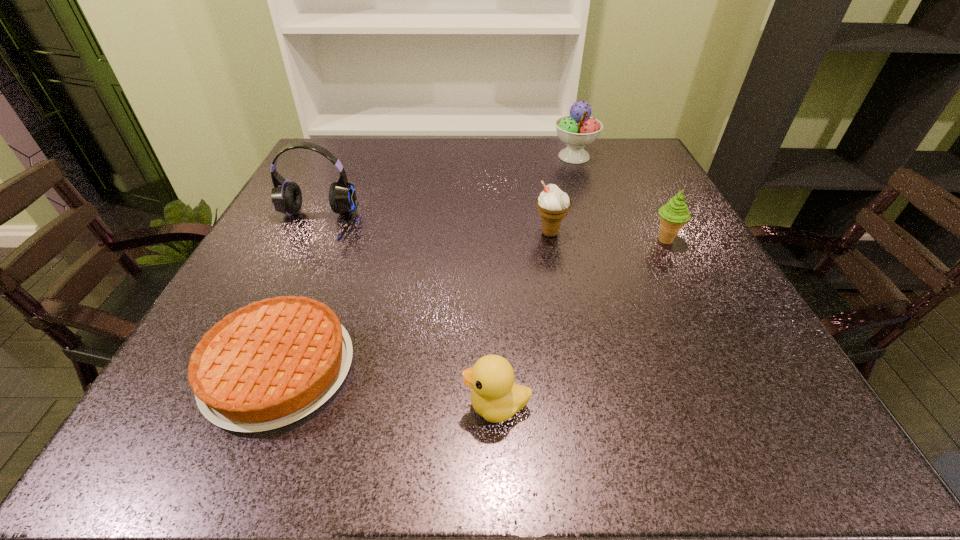
In order to click on vacant point located between the duck and the pie in this screenshot , I will do `click(388, 387)`.

This screenshot has height=540, width=960. Find the location of `unoccupied position between the headset and the rightmost icecream`. unoccupied position between the headset and the rightmost icecream is located at coordinates (491, 233).

I want to click on vacant space that is in between the shortest object and the rightmost icecream, so click(x=472, y=305).

The height and width of the screenshot is (540, 960). What are the coordinates of `empty space that is in between the fourth object from right to left and the shortest object` in the screenshot? It's located at (388, 387).

At what (x,y) coordinates should I click in order to perform the action: click on vacant area that lies between the third object from left to right and the farthest icecream. Please return your answer as a coordinate pair (x, y). The height and width of the screenshot is (540, 960). Looking at the image, I should click on (536, 281).

Identify the location of free space between the fifth tallest object and the rightmost object. The image size is (960, 540). (581, 323).

Where is `vacant area that lies between the third object from right to left and the headset`? vacant area that lies between the third object from right to left and the headset is located at coordinates (432, 230).

What are the coordinates of `object that can be found as the closest to the shortest object` in the screenshot? It's located at (495, 396).

Select which object appears as the fourth closest to the rightmost icecream. Please provide its 2D coordinates. Your answer should be formatted as a tuple, i.e. [(x, y)], where the tuple contains the x and y coordinates of a point satisfying the conditions above.

[(271, 363)]

Identify which icecream is the third nearest to the fifth tallest object. Please provide its 2D coordinates. Your answer should be formatted as a tuple, i.e. [(x, y)], where the tuple contains the x and y coordinates of a point satisfying the conditions above.

[(577, 130)]